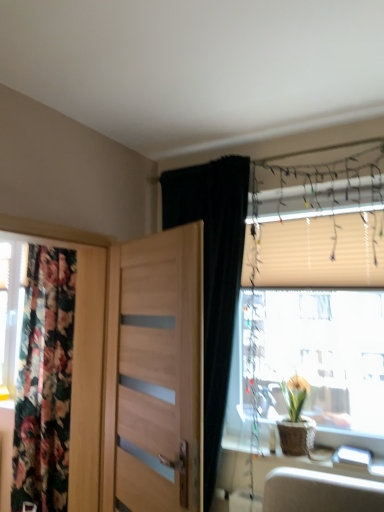
Locate an element on the screen. Image resolution: width=384 pixels, height=512 pixels. black velvet curtain at upper center, the 1th curtain from the right is located at coordinates (213, 275).

You are a GUI agent. You are given a task and a screenshot of the screen. Output one action in this format:
    pyautogui.click(x=<x>, y=<y>)
    Task: Click on the matte brown pot at window
    
    Given the screenshot: What is the action you would take?
    pyautogui.click(x=296, y=419)

I want to click on wooden table at right, so click(x=306, y=468).

The width and height of the screenshot is (384, 512). Identify the location of black velvet curtain at upper center, which is counted as the second curtain, starting from the left. (213, 275).

From a real-world perspective, is translucent plastic window at right on light wood door at center?

Correct, in the physical world, translucent plastic window at right is higher than light wood door at center.

How far apart are translucent plastic window at right and light wood door at center?

translucent plastic window at right and light wood door at center are 3.35 feet apart from each other.

Is point (374, 444) closer to viewer compared to point (112, 267)?

Yes.

Is translucent plastic window at right positioned with its back to light wood door at center?

No, translucent plastic window at right is not facing the opposite direction of light wood door at center.

From a real-world perspective, who is located higher, wooden table at right or black velvet curtain at upper center, the 1th curtain from the right?

black velvet curtain at upper center, the 1th curtain from the right, is physically above.

Can we say wooden table at right lies outside black velvet curtain at upper center, which is the second curtain in back-to-front order?

wooden table at right lies outside black velvet curtain at upper center, which is the second curtain in back-to-front order,'s area.

Is floral fabric curtain at left, positioned as the 2th curtain in right-to-left order, taller than light wood door at center?

Indeed, floral fabric curtain at left, positioned as the 2th curtain in right-to-left order, has a greater height compared to light wood door at center.

Locate an element on the screen. door in front of the floral fabric curtain at left, which ranks as the 1th curtain in left-to-right order is located at coordinates (155, 374).

Does floral fabric curtain at left, which ranks as the 1th curtain in left-to-right order, turn towards light wood door at center?

No, floral fabric curtain at left, which ranks as the 1th curtain in left-to-right order, is not aimed at light wood door at center.

Which is behind, floral fabric curtain at left, which ranks as the 1th curtain in back-to-front order, or light wood door at center?

floral fabric curtain at left, which ranks as the 1th curtain in back-to-front order, is further away from the camera.

Do you think matte brown pot at window is within beige fabric blind at upper right, or outside of it?

matte brown pot at window cannot be found inside beige fabric blind at upper right.

From a real-world perspective, between matte brown pot at window and beige fabric blind at upper right, who is vertically lower?

In real-world perspective, matte brown pot at window is lower.

Can you confirm if floral fabric curtain at left, which ranks as the 1th curtain in left-to-right order, is smaller than matte brown pot at window?

No.

Between floral fabric curtain at left, which ranks as the 1th curtain in left-to-right order, and matte brown pot at window, which one appears on the left side from the viewer's perspective?

floral fabric curtain at left, which ranks as the 1th curtain in left-to-right order.

Considering the sizes of floral fabric curtain at left, the second curtain positioned from the front, and matte brown pot at window in the image, is floral fabric curtain at left, the second curtain positioned from the front, wider or thinner than matte brown pot at window?

In the image, floral fabric curtain at left, the second curtain positioned from the front, appears to be more narrow than matte brown pot at window.

From the picture: How different are the orientations of floral fabric curtain at left, which ranks as the 1th curtain in left-to-right order, and matte brown pot at window in degrees?

They differ by 1.1 degrees in their facing directions.

From the picture: Which of these two, floral fabric curtain at left, which ranks as the 1th curtain in back-to-front order, or beige fabric blind at upper right, is bigger?

floral fabric curtain at left, which ranks as the 1th curtain in back-to-front order.

How much distance is there between floral fabric curtain at left, which ranks as the 1th curtain in back-to-front order, and beige fabric blind at upper right?

floral fabric curtain at left, which ranks as the 1th curtain in back-to-front order, and beige fabric blind at upper right are 5.65 feet apart from each other.

Is beige fabric blind at upper right surrounded by floral fabric curtain at left, positioned as the 2th curtain in right-to-left order?

That's incorrect, beige fabric blind at upper right is not inside floral fabric curtain at left, positioned as the 2th curtain in right-to-left order.

From the image's perspective, is black velvet curtain at upper center, the 1th curtain from the right, below floral fabric curtain at left, the second curtain positioned from the front?

Incorrect, from the image's perspective, black velvet curtain at upper center, the 1th curtain from the right, is higher than floral fabric curtain at left, the second curtain positioned from the front.

Identify the location of curtain that is behind the black velvet curtain at upper center, the 1th curtain from the right. (44, 382).

Measure the distance from black velvet curtain at upper center, which is counted as the second curtain, starting from the left, to floral fabric curtain at left, which ranks as the 1th curtain in back-to-front order.

black velvet curtain at upper center, which is counted as the second curtain, starting from the left, and floral fabric curtain at left, which ranks as the 1th curtain in back-to-front order, are 4.39 feet apart.

Is black velvet curtain at upper center, the first curtain in the front-to-back sequence, not inside floral fabric curtain at left, which ranks as the 1th curtain in left-to-right order?

Indeed, black velvet curtain at upper center, the first curtain in the front-to-back sequence, is completely outside floral fabric curtain at left, which ranks as the 1th curtain in left-to-right order.

Locate an element on the screen. The width and height of the screenshot is (384, 512). door in front of the translucent plastic window at right is located at coordinates (155, 374).

Image resolution: width=384 pixels, height=512 pixels. Identify the location of the 2nd curtain directly above the wooden table at right (from a real-world perspective). (213, 275).

Based on their spatial positions, is black velvet curtain at upper center, the 1th curtain from the right, or light wood door at center closer to beige fabric blind at upper right?

black velvet curtain at upper center, the 1th curtain from the right, lies closer to beige fabric blind at upper right than the other object.

When comparing their distances from wooden table at right, does matte brown pot at window or black velvet curtain at upper center, which is counted as the second curtain, starting from the left, seem further?

Based on the image, black velvet curtain at upper center, which is counted as the second curtain, starting from the left, appears to be further to wooden table at right.

Looking at the image, which one is located closer to beige fabric blind at upper right, wooden table at right or matte brown pot at window?

matte brown pot at window.

From the image, which object appears to be nearer to floral fabric curtain at left, which ranks as the 1th curtain in back-to-front order, translucent plastic window at right or black velvet curtain at upper center, which is counted as the second curtain, starting from the left?

Among the two, black velvet curtain at upper center, which is counted as the second curtain, starting from the left, is located nearer to floral fabric curtain at left, which ranks as the 1th curtain in back-to-front order.

From the image, which object appears to be nearer to beige fabric blind at upper right, light wood door at center or black velvet curtain at upper center, which is counted as the second curtain, starting from the left?

black velvet curtain at upper center, which is counted as the second curtain, starting from the left.

Considering their positions, is floral fabric curtain at left, positioned as the 2th curtain in right-to-left order, positioned closer to translucent plastic window at right than matte brown pot at window?

matte brown pot at window is positioned closer to the anchor translucent plastic window at right.

Considering their positions, is matte brown pot at window positioned closer to beige fabric blind at upper right than light wood door at center?

Among the two, matte brown pot at window is located nearer to beige fabric blind at upper right.

Which object lies further to the anchor point matte brown pot at window, light wood door at center or beige fabric blind at upper right?

light wood door at center lies further to matte brown pot at window than the other object.

The image size is (384, 512). What are the coordinates of `window between beige fabric blind at upper right and wooden table at right vertically` in the screenshot? It's located at (312, 329).

Find the location of `houseplant between beige fabric blind at upper right and wooden table at right vertically`. houseplant between beige fabric blind at upper right and wooden table at right vertically is located at coordinates (296, 419).

At what (x,y) coordinates should I click in order to perform the action: click on table between light wood door at center and translucent plastic window at right in the horizontal direction. Please return your answer as a coordinate pair (x, y). This screenshot has height=512, width=384. Looking at the image, I should click on (306, 468).

I want to click on window between black velvet curtain at upper center, which is the second curtain in back-to-front order, and beige fabric blind at upper right, in the horizontal direction, so click(x=312, y=329).